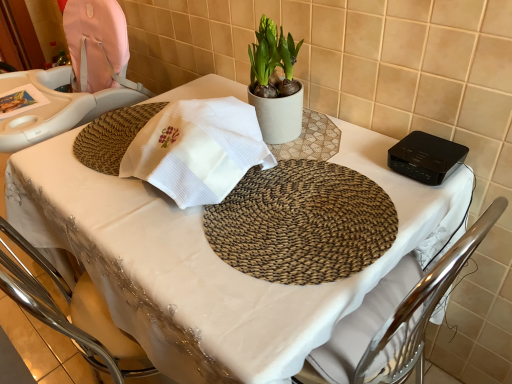
This screenshot has width=512, height=384. Identify the location of vacant space that is in between black plastic device at upper right and matte beige pot at center. (348, 146).